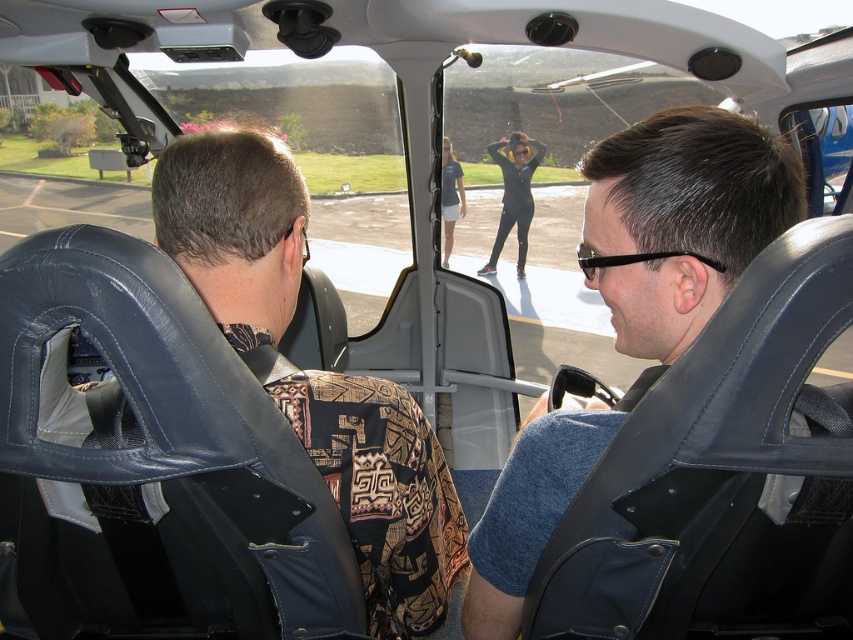
You are a passenger in the helicopter and want to determine the relative positions of the blue fabric shirt at center and the black matte pants at center. Which one is shorter in height?

The blue fabric shirt at center has a lesser height compared to the black matte pants at center, so the blue fabric shirt at center is shorter in height.

You are designing a uniform for helicopter pilots and need to ensure the shirt and pants fit properly. Given the blue fabric shirt at center and black matte pants at center, which clothing item has a narrower width?

The blue fabric shirt at center has a narrower width than the black matte pants at center.

You are a passenger in the helicopter and want to take a photo of the two points inside the helicopter. Which point, point (502, 531) or point (241, 310), will appear larger in your photo?

Point (502, 531) will appear larger in the photo because it is closer to the camera than point (241, 310).